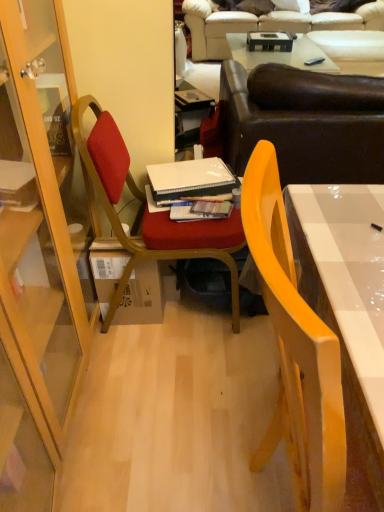
Question: In the image, is velvet red chair at center, the 2th chair in the front-to-back sequence, positioned in front of or behind beige leather couch at upper center, which ranks as the first studio couch in top-to-bottom order?

Choices:
 (A) front
 (B) behind

Answer: (A)

Question: In terms of height, does velvet red chair at center, acting as the first chair starting from the back, look taller or shorter compared to beige leather couch at upper center, the first studio couch positioned from the back?

Choices:
 (A) tall
 (B) short

Answer: (A)

Question: Based on their relative distances, which object is nearer to the yellow glossy chair at right, the second chair from the back?

Choices:
 (A) hardcover book at center, which is the 2th book from back to front
 (B) velvet red chair at center, the 2th chair in the front-to-back sequence
 (C) beige leather couch at upper center, marked as the second studio couch in a bottom-to-top arrangement
 (D) brown leather couch at upper center, which is the second studio couch in back-to-front order
 (E) white matte notebook at center, the 1th book from the back

Answer: (B)

Question: Which of these objects is positioned farthest from the beige leather couch at upper center, which appears as the second studio couch when viewed from the front?

Choices:
 (A) yellow glossy chair at right, the second chair from the back
 (B) white matte notebook at center, the 1th book from the back
 (C) brown leather couch at upper center, which is the second studio couch in back-to-front order
 (D) velvet red chair at center, the 2th chair in the front-to-back sequence
 (E) matte cardboard box at center

Answer: (A)